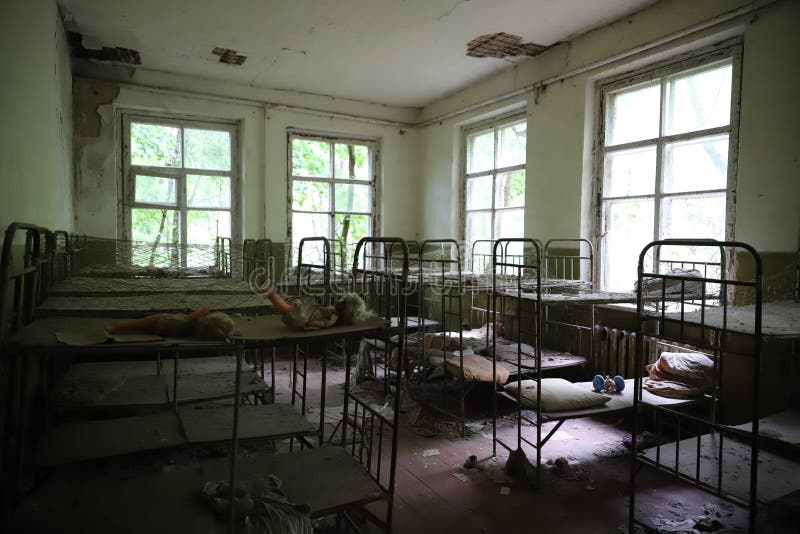
This screenshot has height=534, width=800. I want to click on window on sunny side, so click(694, 217), click(618, 223), click(638, 164), click(698, 172), click(622, 98), click(718, 92).